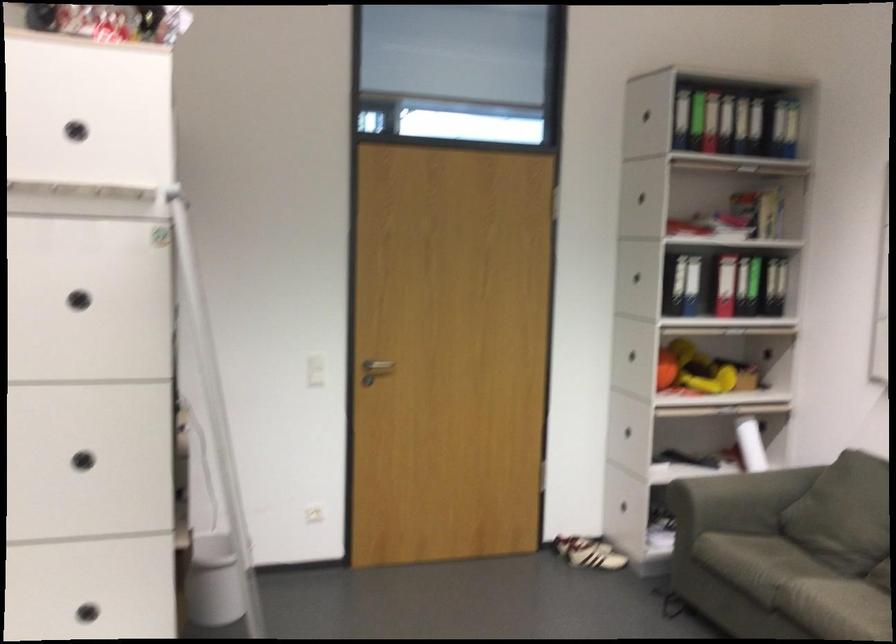
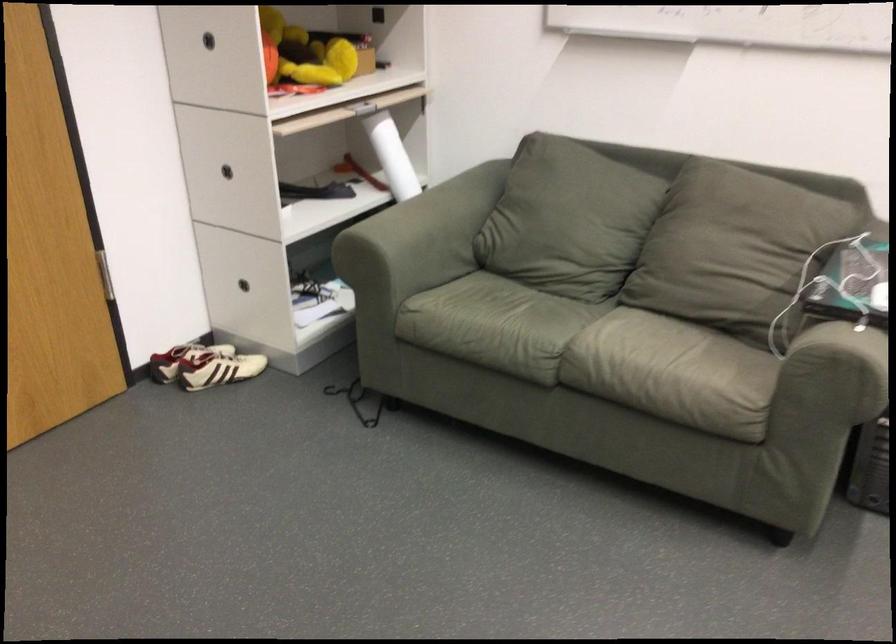
In the second image, find the point that corresponds to (744,440) in the first image.

(392, 156)